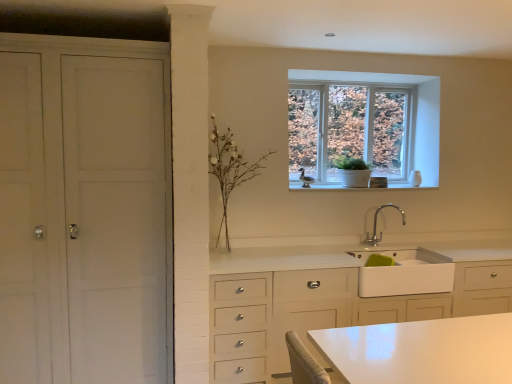
Question: Choose the correct answer: Is white matte plant at center inside white matte cabinet at left or outside it?

Choices:
 (A) outside
 (B) inside

Answer: (A)

Question: From a real-world perspective, is white matte plant at center positioned above or below white matte cabinet at left?

Choices:
 (A) above
 (B) below

Answer: (A)

Question: Considering the real-world distances, which object is closest to the white matte sink at lower center?

Choices:
 (A) white matte plant at center
 (B) white matte cabinet at left
 (C) clear glass window at upper center
 (D) silver metallic faucet at upper center

Answer: (D)

Question: Which object is positioned closest to the white matte sink at lower center?

Choices:
 (A) white matte cabinet at left
 (B) white matte plant at center
 (C) silver metallic faucet at upper center
 (D) clear glass window at upper center

Answer: (C)